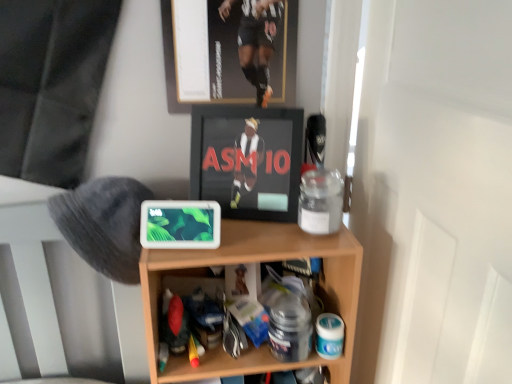
Question: From the image's perspective, does metallic gold picture frame at upper center appear lower than gray fuzzy hat at left?

Choices:
 (A) yes
 (B) no

Answer: (B)

Question: Is the depth of metallic gold picture frame at upper center greater than that of gray fuzzy hat at left?

Choices:
 (A) no
 (B) yes

Answer: (B)

Question: From the image's perspective, is metallic gold picture frame at upper center above gray fuzzy hat at left?

Choices:
 (A) no
 (B) yes

Answer: (B)

Question: From a real-world perspective, is metallic gold picture frame at upper center over gray fuzzy hat at left?

Choices:
 (A) yes
 (B) no

Answer: (A)

Question: Does metallic gold picture frame at upper center have a greater width compared to gray fuzzy hat at left?

Choices:
 (A) no
 (B) yes

Answer: (A)

Question: Considering the relative sizes of metallic gold picture frame at upper center and gray fuzzy hat at left in the image provided, is metallic gold picture frame at upper center shorter than gray fuzzy hat at left?

Choices:
 (A) no
 (B) yes

Answer: (A)

Question: Can you confirm if gray fuzzy hat at left is positioned to the left of wooden shelf at center?

Choices:
 (A) no
 (B) yes

Answer: (B)

Question: Is gray fuzzy hat at left positioned beyond the bounds of wooden shelf at center?

Choices:
 (A) yes
 (B) no

Answer: (A)

Question: Considering the relative sizes of gray fuzzy hat at left and wooden shelf at center in the image provided, is gray fuzzy hat at left bigger than wooden shelf at center?

Choices:
 (A) yes
 (B) no

Answer: (B)

Question: Is gray fuzzy hat at left looking in the opposite direction of wooden shelf at center?

Choices:
 (A) no
 (B) yes

Answer: (A)

Question: From the image's perspective, is gray fuzzy hat at left beneath wooden shelf at center?

Choices:
 (A) yes
 (B) no

Answer: (B)

Question: From a real-world perspective, is gray fuzzy hat at left located beneath wooden shelf at center?

Choices:
 (A) no
 (B) yes

Answer: (A)

Question: Does wooden shelf at center have a greater height compared to black glossy frame at center?

Choices:
 (A) yes
 (B) no

Answer: (A)